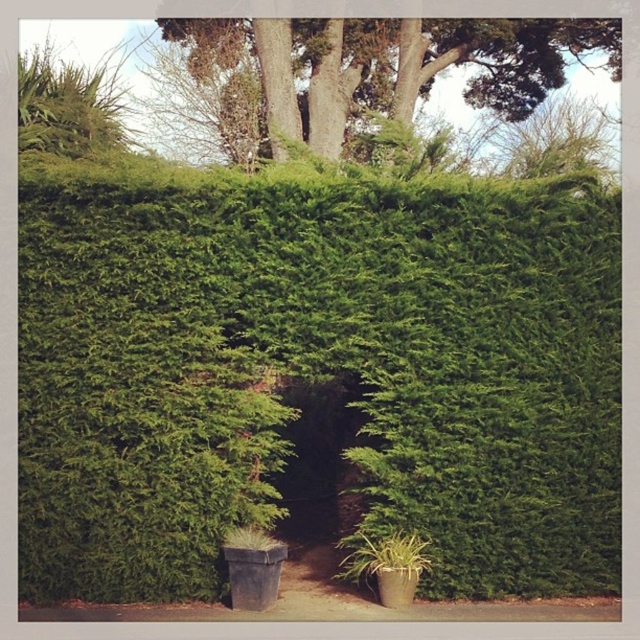
Question: Is green leafy hedge at center smaller than green leafy tree at upper center?

Choices:
 (A) no
 (B) yes

Answer: (A)

Question: Among these objects, which one is farthest from the camera?

Choices:
 (A) green leafy hedge at center
 (B) green leafy tree at upper center

Answer: (B)

Question: Can you confirm if green leafy hedge at center is positioned to the left of green leafy tree at upper center?

Choices:
 (A) yes
 (B) no

Answer: (A)

Question: Which of the following is the farthest from the observer?

Choices:
 (A) green leafy tree at upper center
 (B) green leafy hedge at center

Answer: (A)

Question: Which of the following is the farthest from the observer?

Choices:
 (A) (403, 49)
 (B) (352, 358)

Answer: (A)

Question: From the image, what is the correct spatial relationship of green leafy hedge at center in relation to green leafy tree at upper center?

Choices:
 (A) above
 (B) below

Answer: (B)